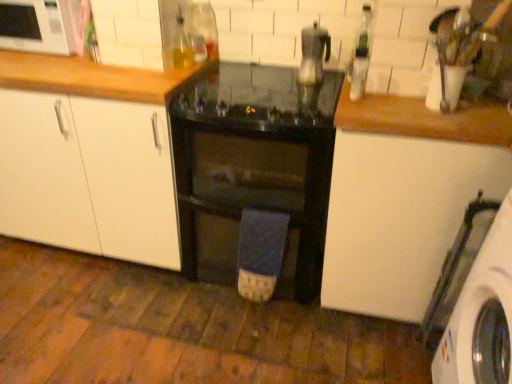
Locate an element on the screen. The height and width of the screenshot is (384, 512). vacant space to the left of white matte cabinet at upper center, positioned as the second cabinetry in left-to-right order is located at coordinates (82, 64).